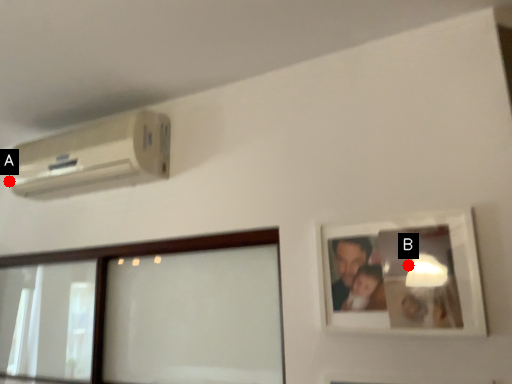
Question: Two points are circled on the image, labeled by A and B beside each circle. Which point is farther to the camera?

Choices:
 (A) A is further
 (B) B is further

Answer: (A)